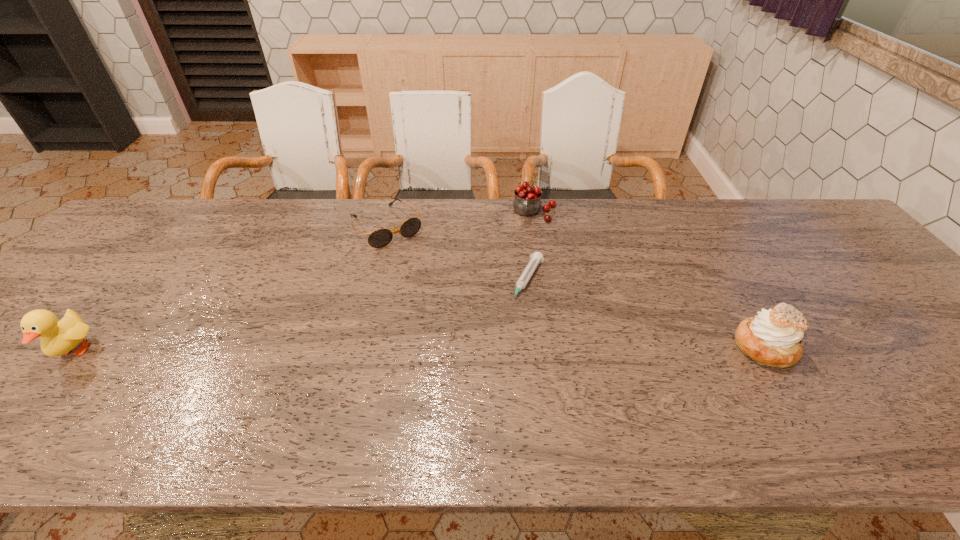
Where is `the leftmost object`? Image resolution: width=960 pixels, height=540 pixels. the leftmost object is located at coordinates (58, 338).

In order to click on the rightmost object in this screenshot , I will do `click(773, 338)`.

Where is `the fourth object from right to left`? This screenshot has width=960, height=540. the fourth object from right to left is located at coordinates (379, 238).

At what (x,y) coordinates should I click in order to perform the action: click on the second shortest object. Please return your answer as a coordinate pair (x, y). The height and width of the screenshot is (540, 960). Looking at the image, I should click on (379, 238).

Find the location of a particular element. This screenshot has height=540, width=960. pot filled with cherries is located at coordinates (527, 201).

Where is `the shortest object`? This screenshot has height=540, width=960. the shortest object is located at coordinates (536, 258).

This screenshot has height=540, width=960. I want to click on the third farthest object, so click(x=536, y=258).

Find the location of a particular element. This screenshot has width=960, height=540. free location located 0.080m on the front-facing side of the duckling is located at coordinates (28, 406).

At what (x,y) coordinates should I click in order to perform the action: click on free space located 0.210m on the back of the rightmost object. Please return your answer as a coordinate pair (x, y). The image size is (960, 540). Looking at the image, I should click on (717, 267).

Image resolution: width=960 pixels, height=540 pixels. I want to click on vacant space located 0.080m on the front-facing side of the sunglasses, so click(415, 262).